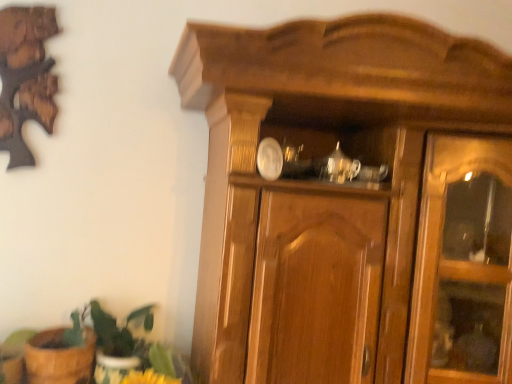
What do you see at coordinates (119, 338) in the screenshot? This screenshot has width=512, height=384. I see `green leafy plant at lower left` at bounding box center [119, 338].

The image size is (512, 384). Identify the location of green leafy plant at lower left. (119, 338).

The image size is (512, 384). What do you see at coordinates (59, 358) in the screenshot?
I see `brown woven basket at lower left` at bounding box center [59, 358].

In order to face brown woven basket at lower left, should I rotate leftwards or rightwards?

A 24.631 degree turn to the left will do.

Image resolution: width=512 pixels, height=384 pixels. Identify the location of brown woven basket at lower left. (59, 358).

Identify the location of green leafy plant at lower left. (119, 338).

Which object is positioned more to the left, brown woven basket at lower left or green leafy plant at lower left?

Positioned to the left is brown woven basket at lower left.

Consider the image. Is brown woven basket at lower left in front of green leafy plant at lower left?

Yes, brown woven basket at lower left is closer to the camera.

Between point (84, 354) and point (147, 305), which one is positioned in front?

Point (84, 354)

From the image's perspective, is brown woven basket at lower left located above green leafy plant at lower left?

Actually, brown woven basket at lower left appears below green leafy plant at lower left in the image.

From a real-world perspective, who is located lower, brown woven basket at lower left or green leafy plant at lower left?

brown woven basket at lower left, from a real-world perspective.

In the scene shown: Can you confirm if brown woven basket at lower left is thinner than green leafy plant at lower left?

Indeed, brown woven basket at lower left has a lesser width compared to green leafy plant at lower left.

Between brown woven basket at lower left and green leafy plant at lower left, which one has less height?

With less height is brown woven basket at lower left.

Does brown woven basket at lower left have a smaller size compared to green leafy plant at lower left?

Yes, brown woven basket at lower left is smaller than green leafy plant at lower left.

Is brown woven basket at lower left located outside green leafy plant at lower left?

No, brown woven basket at lower left is inside or overlapping with green leafy plant at lower left.

Is brown woven basket at lower left in contact with green leafy plant at lower left?

Absolutely, brown woven basket at lower left is next to and touching green leafy plant at lower left.

Looking at this image, could you tell me if brown woven basket at lower left is turned towards green leafy plant at lower left?

No.

Find the location of a particular element. This screenshot has height=384, width=512. houseplant behind the brown woven basket at lower left is located at coordinates (119, 338).

Considering the positions of objects green leafy plant at lower left and brown woven basket at lower left in the image provided, who is more to the left, green leafy plant at lower left or brown woven basket at lower left?

Positioned to the left is brown woven basket at lower left.

Which object is further away from the camera, green leafy plant at lower left or brown woven basket at lower left?

green leafy plant at lower left is more distant.

Considering the points (128, 328) and (79, 364), which point is behind, point (128, 328) or point (79, 364)?

The point (128, 328) is farther from the camera.

From the image's perspective, between green leafy plant at lower left and brown woven basket at lower left, which one is located above?

green leafy plant at lower left, from the image's perspective.

From a real-world perspective, between green leafy plant at lower left and brown woven basket at lower left, who is vertically lower?

In real-world perspective, brown woven basket at lower left is lower.

Can you confirm if green leafy plant at lower left is wider than brown woven basket at lower left?

Yes, green leafy plant at lower left is wider than brown woven basket at lower left.

Does green leafy plant at lower left have a greater height compared to brown woven basket at lower left?

Correct, green leafy plant at lower left is much taller as brown woven basket at lower left.

Looking at this image, who is bigger, green leafy plant at lower left or brown woven basket at lower left?

green leafy plant at lower left is bigger.

Is brown woven basket at lower left located within green leafy plant at lower left?

Indeed, brown woven basket at lower left is located within green leafy plant at lower left.

Would you consider green leafy plant at lower left to be distant from brown woven basket at lower left?

They are positioned close to each other.

In the scene shown: Is brown woven basket at lower left at the back of green leafy plant at lower left?

No.

Where is `houseplant on the right of brown woven basket at lower left`? Image resolution: width=512 pixels, height=384 pixels. houseplant on the right of brown woven basket at lower left is located at coordinates (119, 338).

Find the location of a particular element. This screenshot has height=384, width=512. houseplant on the right of brown woven basket at lower left is located at coordinates (119, 338).

Find the location of a particular element. houseplant lying above the brown woven basket at lower left (from the image's perspective) is located at coordinates (119, 338).